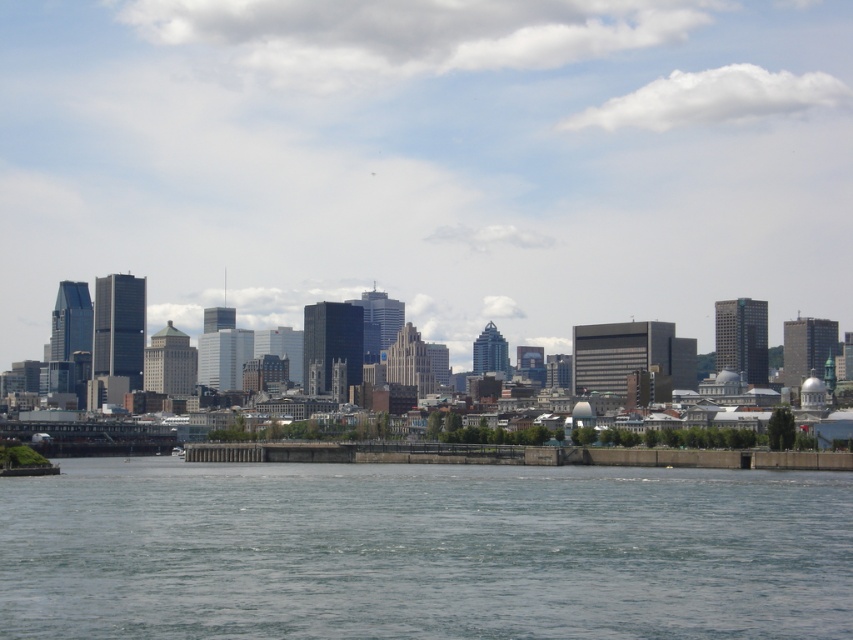
Is matte glass buildings at center thinner than clear water at lower center?

In fact, matte glass buildings at center might be wider than clear water at lower center.

Does matte glass buildings at center appear under clear water at lower center?

No, matte glass buildings at center is not below clear water at lower center.

Which is in front, point (756, 16) or point (277, 540)?

Positioned in front is point (277, 540).

Locate an element on the screen. matte glass buildings at center is located at coordinates (428, 161).